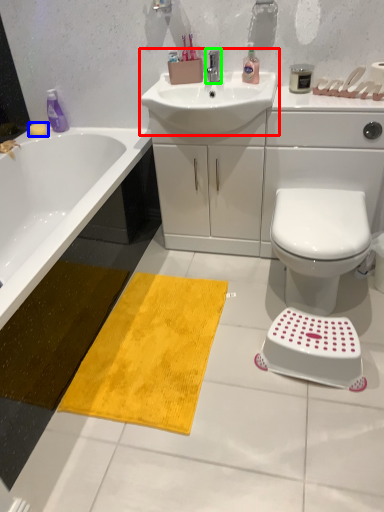
Question: Which object is the closest to the sink (highlighted by a red box)? Choose among these: soap (highlighted by a blue box) or tap (highlighted by a green box).

Choices:
 (A) soap
 (B) tap

Answer: (B)